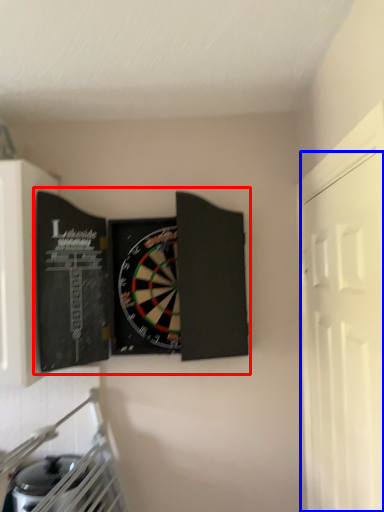
Question: Which point is further to the camera, book (highlighted by a red box) or door (highlighted by a blue box)?

Choices:
 (A) book
 (B) door

Answer: (A)